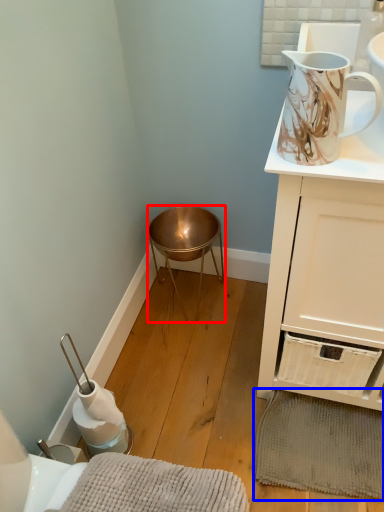
Question: Which of the following is the farthest to the observer, stool (highlighted by a red box) or bath mat (highlighted by a blue box)?

Choices:
 (A) stool
 (B) bath mat

Answer: (A)